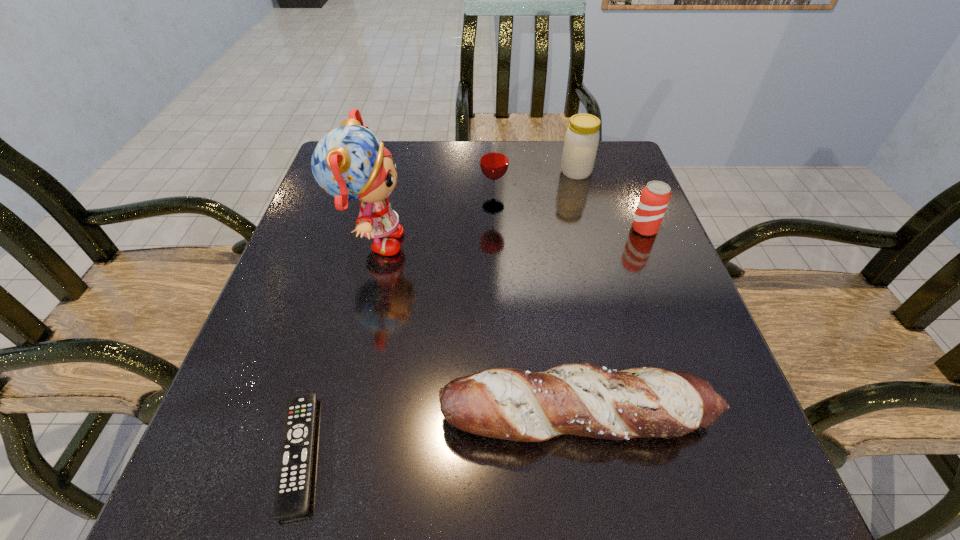
The width and height of the screenshot is (960, 540). What are the coordinates of `free space that is in between the jar and the third shortest object` in the screenshot? It's located at (611, 200).

Identify the location of free spot between the tallest object and the farthest object. The width and height of the screenshot is (960, 540). (474, 208).

This screenshot has width=960, height=540. I want to click on empty space that is in between the glass and the tallest object, so point(433,225).

Locate an element on the screen. The width and height of the screenshot is (960, 540). free space between the fourth tallest object and the shortest object is located at coordinates (472, 341).

Where is `free point between the glass and the shortest object`? free point between the glass and the shortest object is located at coordinates (396, 330).

The height and width of the screenshot is (540, 960). What are the coordinates of `object that stands as the third closest to the farthest object` in the screenshot? It's located at (350, 163).

Identify the location of object that is the fifth nearest to the fourth tallest object. (293, 485).

This screenshot has height=540, width=960. I want to click on free location that satisfies the following two spatial constraints: 1. on the face of the doll; 2. on the back side of the second shortest object, so click(328, 416).

Image resolution: width=960 pixels, height=540 pixels. Identify the location of free location that satisfies the following two spatial constraints: 1. on the back side of the beer can; 2. on the right side of the remote control. 363,230.

The image size is (960, 540). Identify the location of free space that satisfies the following two spatial constraints: 1. on the face of the doll; 2. on the left side of the fifth tallest object. (328, 416).